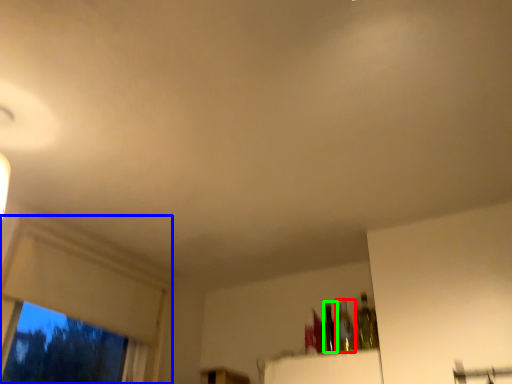
Question: Considering the real-world distances, which object is closest to bottle (highlighted by a red box)? window frame (highlighted by a blue box) or bottle (highlighted by a green box).

Choices:
 (A) window frame
 (B) bottle

Answer: (B)